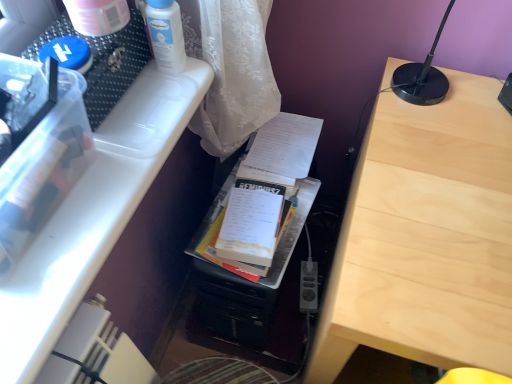
This screenshot has height=384, width=512. Find the location of `vacant space underneath white paper at center (from a real-world perspective)`. vacant space underneath white paper at center (from a real-world perspective) is located at coordinates (285, 140).